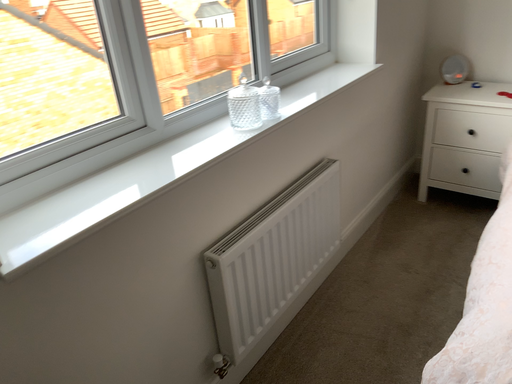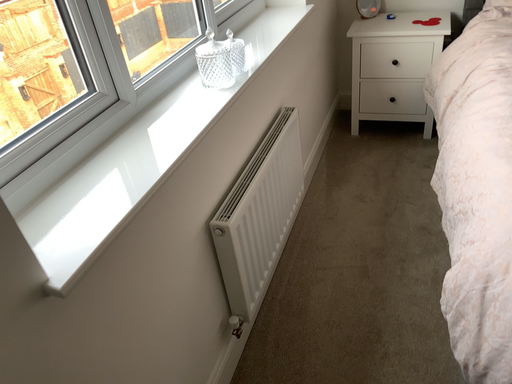
Question: How did the camera likely rotate when shooting the video?

Choices:
 (A) rotated right
 (B) rotated left

Answer: (A)